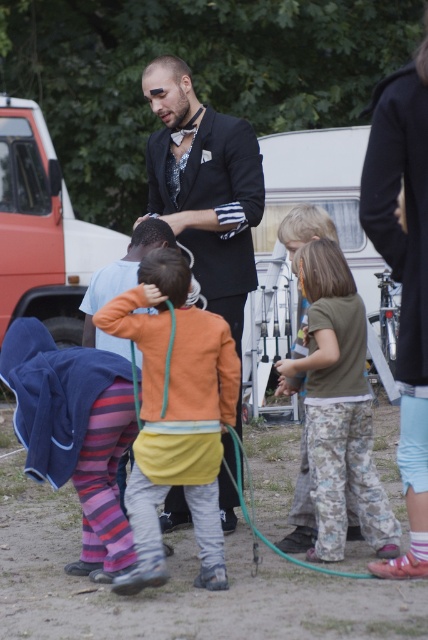
You are a photographer trying to capture a clear shot of the orange cotton shirt at center and the green rubber hose at lower center. Since you want both in focus, which object should you adjust your camera focus on first?

The orange cotton shirt at center is closer to the viewer than the green rubber hose at lower center, so you should focus on the orange cotton shirt at center first to ensure both are in focus.

You are a photographer standing in the scene and want to take a photo of the black satin suit at center and the matte white van at left. Which object will appear larger in the photo?

The black satin suit at center will appear larger in the photo because it is closer to the viewer than the matte white van at left.